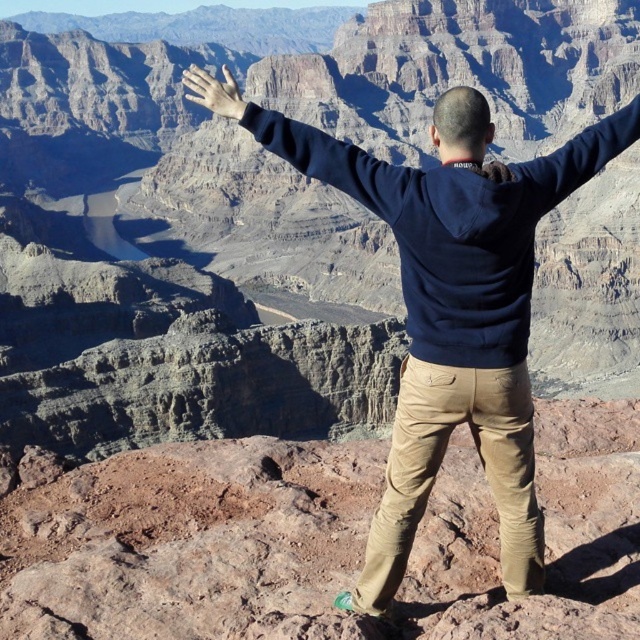
Question: Is dark blue sweatshirt at center positioned at the back of black matte arm at upper center?

Choices:
 (A) yes
 (B) no

Answer: (B)

Question: Does dark blue sweatshirt at center come in front of black matte arm at upper center?

Choices:
 (A) no
 (B) yes

Answer: (B)

Question: Does dark blue sweatshirt at center come behind matte skin hand at upper center?

Choices:
 (A) yes
 (B) no

Answer: (B)

Question: Which point is closer to the camera taking this photo?

Choices:
 (A) click(x=214, y=90)
 (B) click(x=513, y=461)

Answer: (B)

Question: Which object appears closest to the camera in this image?

Choices:
 (A) dark blue sweatshirt at center
 (B) black matte arm at upper center

Answer: (A)

Question: Which object is positioned closest to the dark blue sweatshirt at center?

Choices:
 (A) matte skin hand at upper center
 (B) black matte arm at upper center

Answer: (B)